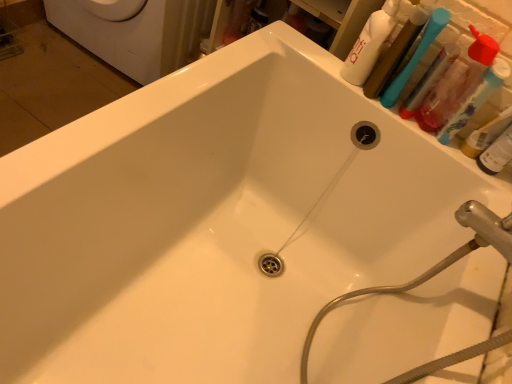
Question: Would you say white glossy washing machine at upper left is inside or outside blue plastic toothbrush at upper right, placed as the 1th toothbrush when sorted from left to right?

Choices:
 (A) inside
 (B) outside

Answer: (B)

Question: Considering their positions, is white glossy washing machine at upper left located in front of or behind blue plastic toothbrush at upper right, placed as the 1th toothbrush when sorted from left to right?

Choices:
 (A) front
 (B) behind

Answer: (B)

Question: Considering the real-world distances, which object is closest to the blue plastic toothbrush at upper right, which is the 1th toothbrush from right to left?

Choices:
 (A) brushed metal hose at upper right
 (B) white glossy washing machine at upper left
 (C) translucent plastic bottle at upper right
 (D) white glossy bottle at upper right
 (E) blue plastic toothbrush at upper right, which appears as the 2th toothbrush when viewed from the right

Answer: (C)

Question: Which object is positioned closest to the brushed metal hose at upper right?

Choices:
 (A) white glossy washing machine at upper left
 (B) translucent plastic bottle at upper right
 (C) blue plastic toothbrush at upper right, which is the 1th toothbrush from right to left
 (D) white glossy bottle at upper right
 (E) blue plastic toothbrush at upper right, placed as the 1th toothbrush when sorted from left to right

Answer: (B)